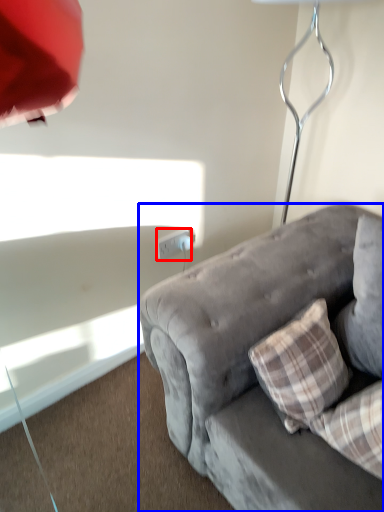
Question: Which object is further to the camera taking this photo, power outlet (highlighted by a red box) or studio couch (highlighted by a blue box)?

Choices:
 (A) power outlet
 (B) studio couch

Answer: (A)